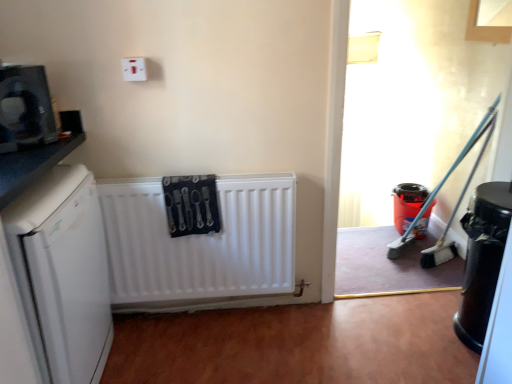
Question: Is matte black microwave at upper left, marked as the 3th appliance in a right-to-left arrangement, at the right side of white matte dishwasher at left?

Choices:
 (A) yes
 (B) no

Answer: (A)

Question: Is matte black microwave at upper left, which is the first appliance in left-to-right order, wider than white matte dishwasher at left?

Choices:
 (A) no
 (B) yes

Answer: (A)

Question: Is matte black microwave at upper left, which is the first appliance in left-to-right order, turned away from white matte dishwasher at left?

Choices:
 (A) no
 (B) yes

Answer: (A)

Question: Is matte black microwave at upper left, the first appliance when ordered from front to back, facing towards white matte dishwasher at left?

Choices:
 (A) no
 (B) yes

Answer: (A)

Question: From the image's perspective, is matte black microwave at upper left, marked as the 3th appliance in a right-to-left arrangement, under white matte dishwasher at left?

Choices:
 (A) no
 (B) yes

Answer: (A)

Question: Is matte black microwave at upper left, which is the first appliance in left-to-right order, to the left or to the right of white matte radiator at center in the image?

Choices:
 (A) right
 (B) left

Answer: (B)

Question: In the image, is matte black microwave at upper left, which is the first appliance in left-to-right order, positioned in front of or behind white matte radiator at center?

Choices:
 (A) behind
 (B) front

Answer: (B)

Question: From a real-world perspective, is matte black microwave at upper left, which is the first appliance in left-to-right order, above or below white matte radiator at center?

Choices:
 (A) above
 (B) below

Answer: (A)

Question: In terms of width, does matte black microwave at upper left, which is the first appliance in left-to-right order, look wider or thinner when compared to white matte radiator at center?

Choices:
 (A) thin
 (B) wide

Answer: (B)

Question: Do you think white plastic electric outlet at upper center is within white matte dishwasher at left, or outside of it?

Choices:
 (A) outside
 (B) inside

Answer: (A)

Question: Considering the relative positions of white plastic electric outlet at upper center and white matte dishwasher at left in the image provided, is white plastic electric outlet at upper center to the left or to the right of white matte dishwasher at left?

Choices:
 (A) left
 (B) right

Answer: (B)

Question: From a real-world perspective, is white plastic electric outlet at upper center above or below white matte dishwasher at left?

Choices:
 (A) below
 (B) above

Answer: (B)

Question: From their relative heights in the image, would you say white plastic electric outlet at upper center is taller or shorter than white matte dishwasher at left?

Choices:
 (A) short
 (B) tall

Answer: (A)

Question: Considering the positions of white matte dishwasher at left and matte black microwave at upper left, the first appliance when ordered from front to back, in the image, is white matte dishwasher at left bigger or smaller than matte black microwave at upper left, the first appliance when ordered from front to back,?

Choices:
 (A) big
 (B) small

Answer: (A)

Question: Is white matte dishwasher at left to the left or to the right of matte black microwave at upper left, which is the first appliance in left-to-right order, in the image?

Choices:
 (A) left
 (B) right

Answer: (A)